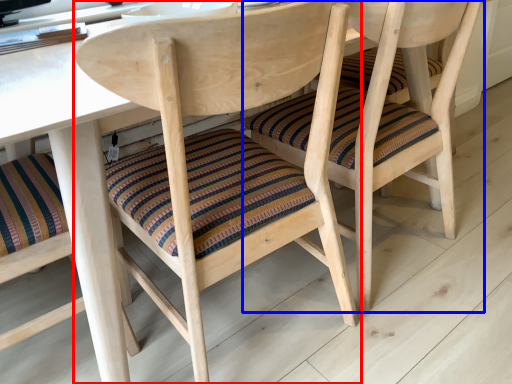
Question: Which object is closer to the camera taking this photo, chair (highlighted by a red box) or chair (highlighted by a blue box)?

Choices:
 (A) chair
 (B) chair

Answer: (A)